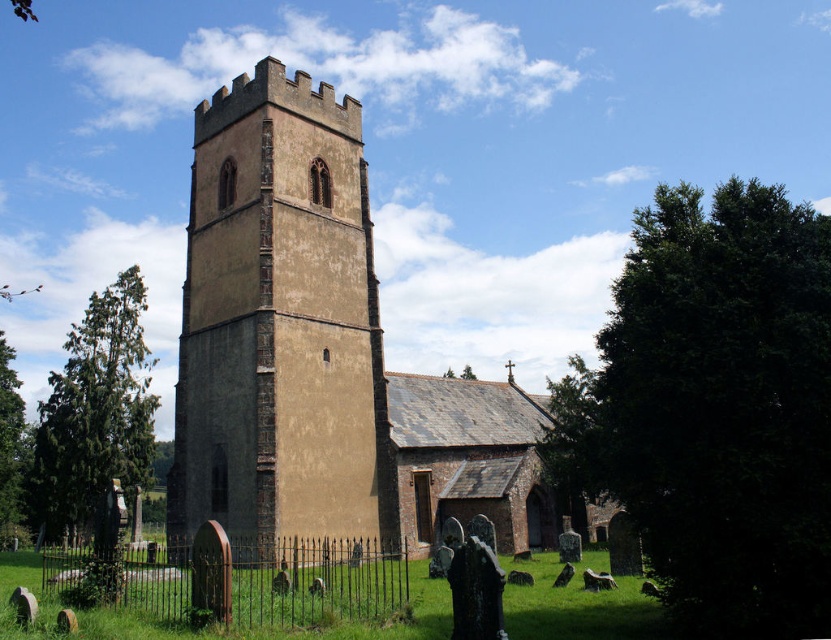
You are standing at the point marked as point (325, 355) in the image of the historic church. Based on the scene description, what structure are you currently positioned on?

The point (325, 355) is on the brown stone church at center, so you are positioned on the brown stone church at center.

You are standing in a field looking at the historic church and its tower. Which structure, the brown stone church at center or the brown stone tower at center, is closer to you?

The brown stone church at center is closer to you because it is in front of the brown stone tower at center.

You are an architect visiting the historic site and want to compare the structures. Based on the scene, which of the two objects, the brown stone church at center or the brown stone tower at center, has a greater width?

The brown stone church at center has a greater width than the brown stone tower at center according to the description provided.